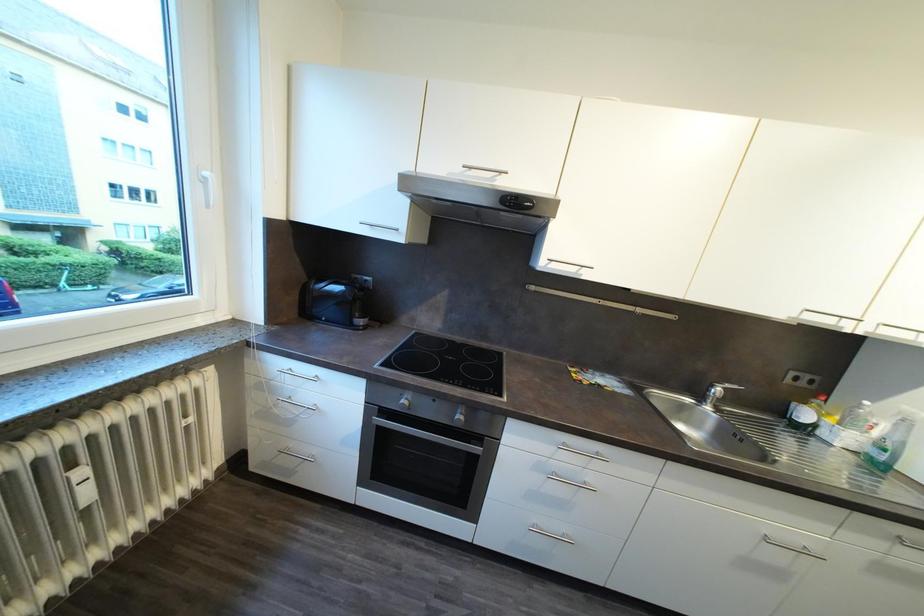
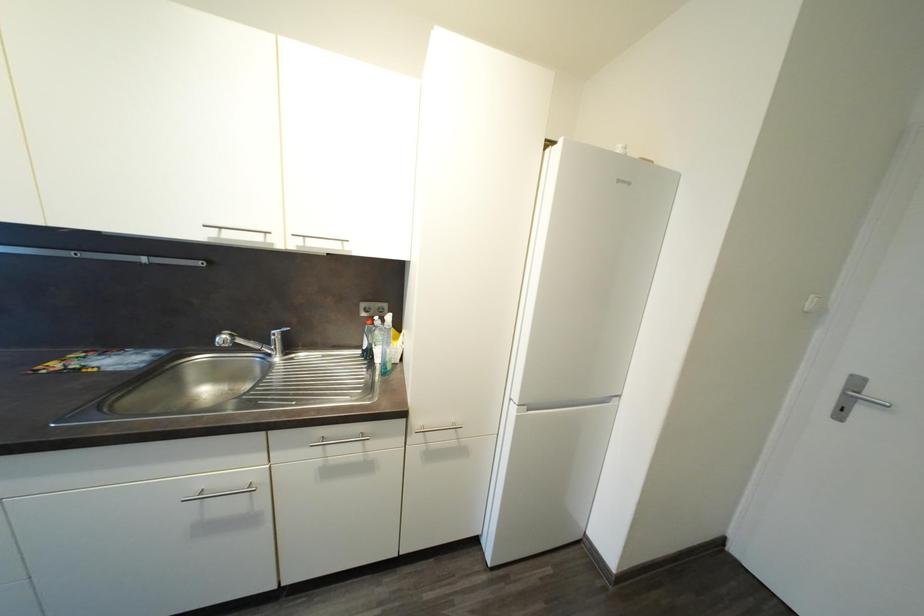
Question: What movement of the cameraman would produce the second image?

Choices:
 (A) Left
 (B) Right
 (C) Forward
 (D) Backward

Answer: (B)